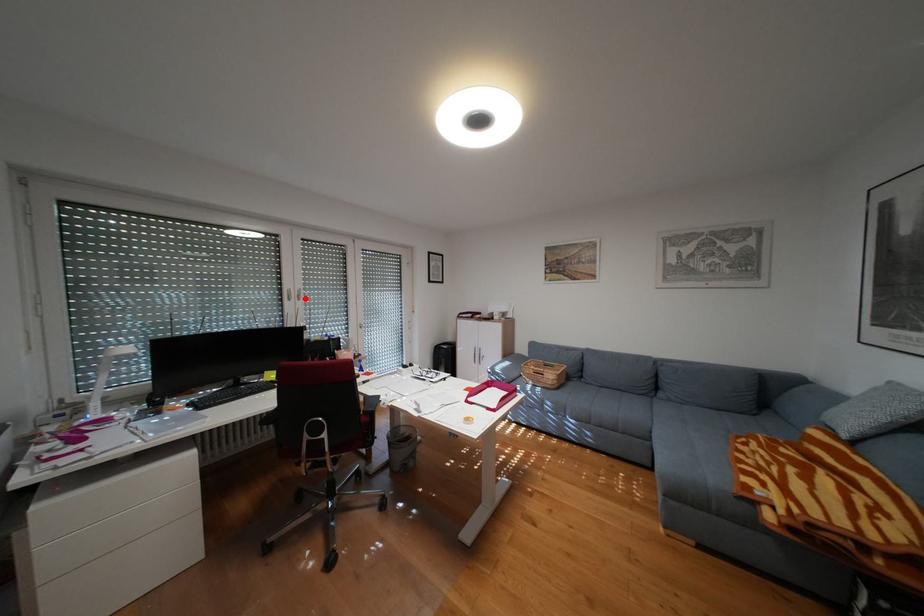
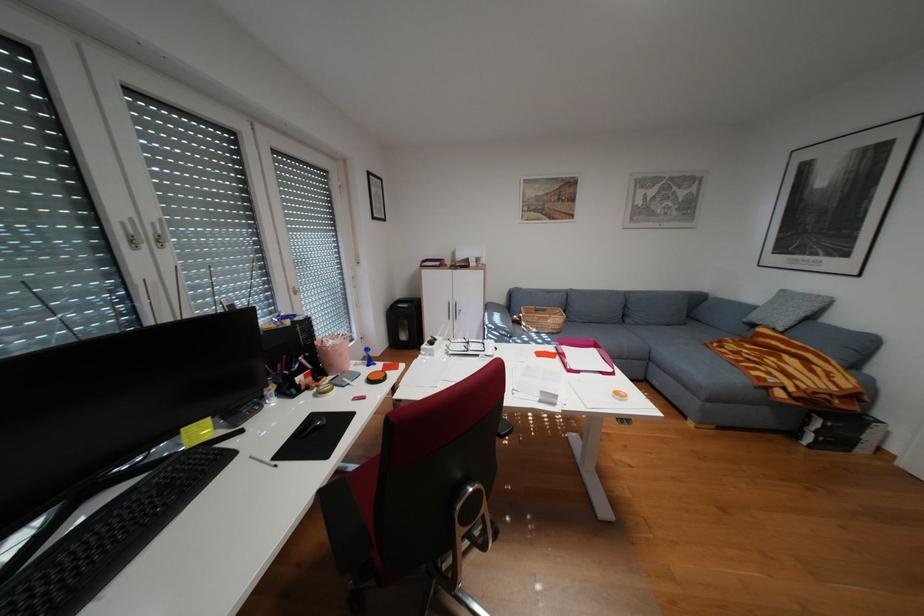
The point at the highlighted location is marked in the first image. Where is the corresponding point in the second image?

(156, 245)